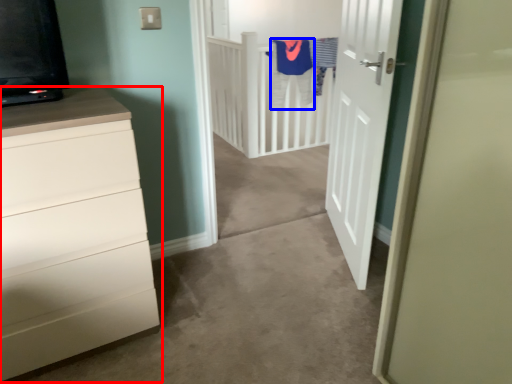
Question: Which of the following is the farthest to the observer, chest of drawers (highlighted by a red box) or robe (highlighted by a blue box)?

Choices:
 (A) chest of drawers
 (B) robe

Answer: (B)